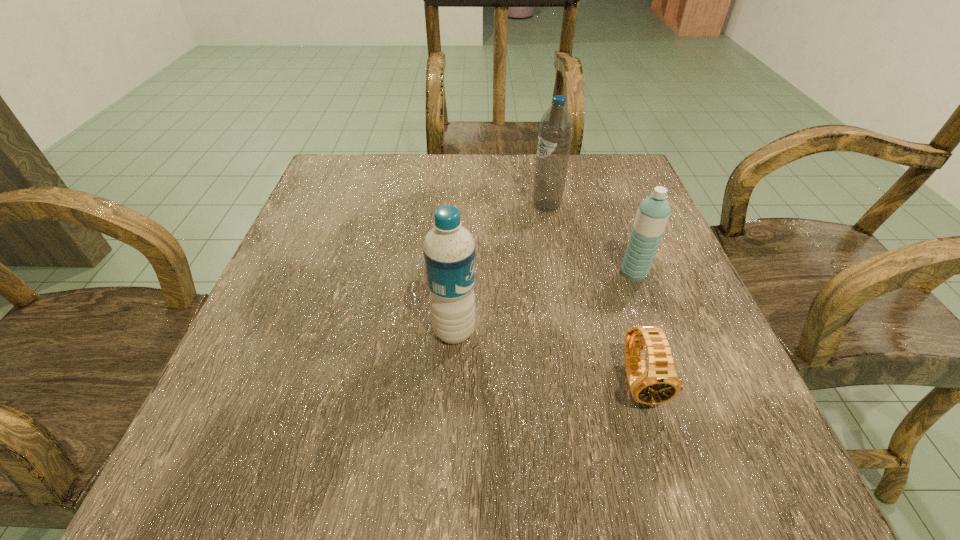
The height and width of the screenshot is (540, 960). I want to click on vacant space at the near left corner, so coord(207,494).

This screenshot has height=540, width=960. In the image, there is a desktop. Find the location of `vacant space at the far right corner`. vacant space at the far right corner is located at coordinates (603, 167).

The image size is (960, 540). In order to click on blank space at the near right corner of the desktop in this screenshot , I will do `click(710, 467)`.

Locate an element on the screen. The width and height of the screenshot is (960, 540). free space between the leftmost water bottle and the shortest object is located at coordinates [547, 357].

Find the location of `empty space between the leftmost water bottle and the watch`. empty space between the leftmost water bottle and the watch is located at coordinates tap(547, 357).

Where is `vacant area between the second water bottle from right to left and the second nearest object`? vacant area between the second water bottle from right to left and the second nearest object is located at coordinates (500, 268).

Image resolution: width=960 pixels, height=540 pixels. I want to click on free space between the farthest object and the third farthest object, so click(500, 268).

In order to click on free spot between the farthest water bottle and the shortest object in this screenshot , I will do coord(593,294).

Locate an element on the screen. The width and height of the screenshot is (960, 540). free spot between the nearest object and the leftmost object is located at coordinates (547, 357).

Identify the location of free point between the second nearest water bottle and the second nearest object. (544, 302).